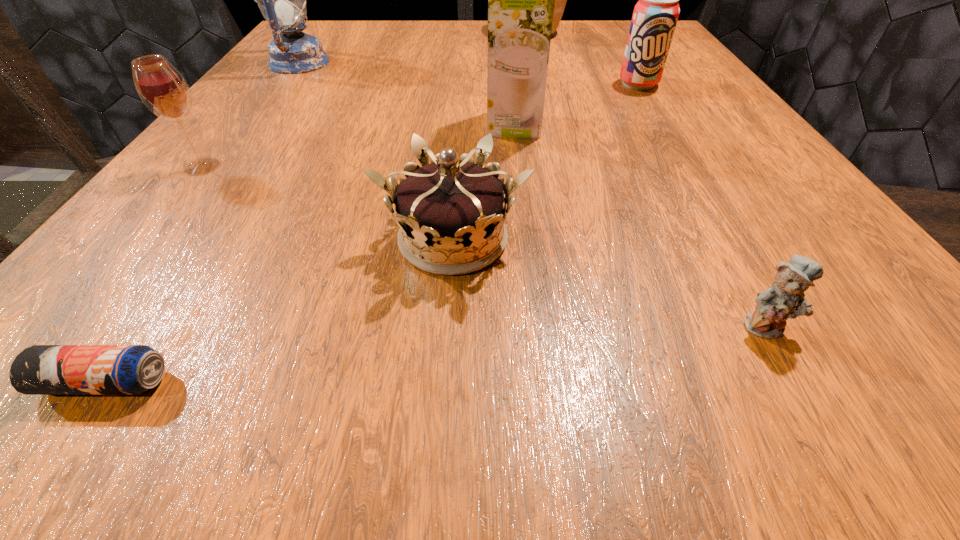
This screenshot has height=540, width=960. Find the location of `object that is positioned at the near left corner`. object that is positioned at the near left corner is located at coordinates (40, 369).

Locate an element on the screen. This screenshot has height=540, width=960. object that is at the near right corner is located at coordinates (784, 299).

Locate an element on the screen. free space at the far edge of the desktop is located at coordinates (457, 42).

Where is `vacant region at the near edge of the desktop`? vacant region at the near edge of the desktop is located at coordinates (464, 382).

Find the location of a particular element. The image size is (960, 540). vacant area at the left edge is located at coordinates (181, 164).

At what (x,y) coordinates should I click in order to perform the action: click on vacant space at the right edge of the desktop. Please return your answer as a coordinate pair (x, y). The width and height of the screenshot is (960, 540). Looking at the image, I should click on (748, 146).

At what (x,y) coordinates should I click in order to perform the action: click on free space at the far left corner of the desktop. Please return your answer as a coordinate pair (x, y). This screenshot has width=960, height=540. Looking at the image, I should click on (339, 56).

At what (x,y) coordinates should I click in order to perform the action: click on vacant space at the near right corner of the desktop. Please return your answer as a coordinate pair (x, y). Looking at the image, I should click on (783, 380).

Image resolution: width=960 pixels, height=540 pixels. Find the location of `free space between the lantern and the sixth tallest object`. free space between the lantern and the sixth tallest object is located at coordinates (376, 151).

The height and width of the screenshot is (540, 960). Identify the location of vacant space that's between the lantern and the second shortest object. (533, 194).